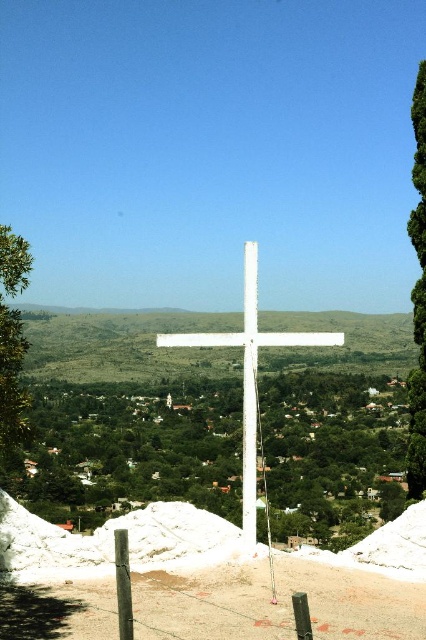
Question: Among these objects, which one is farthest from the camera?

Choices:
 (A) green leafy tree at center
 (B) green leafy tree at right

Answer: (B)

Question: Is green leafy tree at center thinner than green leafy tree at left?

Choices:
 (A) no
 (B) yes

Answer: (A)

Question: Which point is farther to the camera?

Choices:
 (A) white smooth cross at center
 (B) white matte cross at center

Answer: (B)

Question: In this image, where is white smooth cross at center located relative to white matte cross at center?

Choices:
 (A) above
 (B) below

Answer: (A)

Question: Which object appears farthest from the camera in this image?

Choices:
 (A) white matte cross at center
 (B) green leafy tree at center

Answer: (A)

Question: Is white matte cross at center closer to the viewer compared to green leafy tree at right?

Choices:
 (A) yes
 (B) no

Answer: (A)